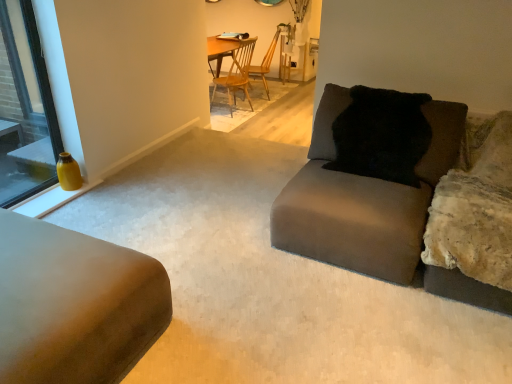
Question: In which direction should I rotate to look at wooden chair at center, which appears as the first chair when viewed from the back?

Choices:
 (A) right
 (B) left

Answer: (A)

Question: Is matte yellow vase at left shorter than wooden chair at center, the second chair from the front?

Choices:
 (A) no
 (B) yes

Answer: (A)

Question: Does matte yellow vase at left have a greater height compared to wooden chair at center, which appears as the first chair when viewed from the back?

Choices:
 (A) no
 (B) yes

Answer: (B)

Question: Does matte yellow vase at left appear on the right side of wooden chair at center, which appears as the first chair when viewed from the back?

Choices:
 (A) no
 (B) yes

Answer: (A)

Question: Is the position of matte yellow vase at left more distant than that of wooden chair at center, the second chair from the front?

Choices:
 (A) yes
 (B) no

Answer: (B)

Question: Is matte yellow vase at left beside wooden chair at center, the second chair from the front?

Choices:
 (A) no
 (B) yes

Answer: (A)

Question: Does matte yellow vase at left have a greater width compared to wooden chair at center, which appears as the first chair when viewed from the back?

Choices:
 (A) yes
 (B) no

Answer: (B)

Question: Considering the relative sizes of suede-like beige couch at lower left, which is counted as the 2th studio couch, starting from the right, and matte gray couch at center, acting as the 1th studio couch starting from the right, in the image provided, is suede-like beige couch at lower left, which is counted as the 2th studio couch, starting from the right, wider than matte gray couch at center, acting as the 1th studio couch starting from the right,?

Choices:
 (A) yes
 (B) no

Answer: (A)

Question: From a real-world perspective, is suede-like beige couch at lower left, which is counted as the 2th studio couch, starting from the right, positioned over matte gray couch at center, acting as the 1th studio couch starting from the right, based on gravity?

Choices:
 (A) yes
 (B) no

Answer: (B)

Question: Is suede-like beige couch at lower left, which is counted as the 2th studio couch, starting from the right, at the left side of matte gray couch at center, acting as the 1th studio couch starting from the right?

Choices:
 (A) yes
 (B) no

Answer: (A)

Question: From the image's perspective, is suede-like beige couch at lower left, which is counted as the 2th studio couch, starting from the right, located beneath matte gray couch at center, the 2th studio couch positioned from the left?

Choices:
 (A) yes
 (B) no

Answer: (A)

Question: From a real-world perspective, does suede-like beige couch at lower left, which is counted as the 2th studio couch, starting from the right, sit lower than matte gray couch at center, acting as the 1th studio couch starting from the right?

Choices:
 (A) yes
 (B) no

Answer: (A)

Question: Is suede-like beige couch at lower left, which is the 1th studio couch from left to right, oriented away from matte gray couch at center, acting as the 1th studio couch starting from the right?

Choices:
 (A) no
 (B) yes

Answer: (A)

Question: Considering the relative sizes of wooden chair at center, the second chair from the front, and matte gray couch at center, the 2th studio couch positioned from the left, in the image provided, is wooden chair at center, the second chair from the front, wider than matte gray couch at center, the 2th studio couch positioned from the left,?

Choices:
 (A) no
 (B) yes

Answer: (A)